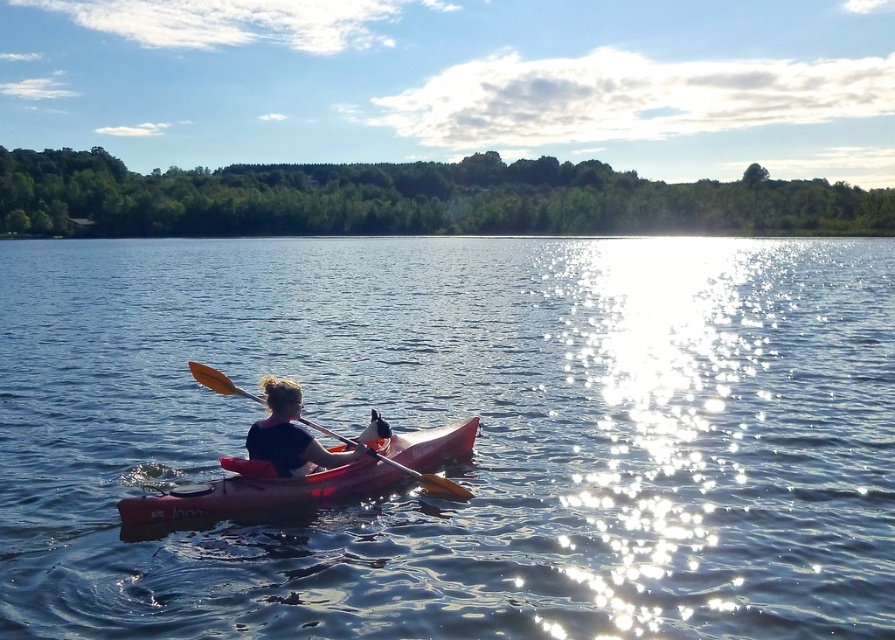
Question: Observing the image, what is the correct spatial positioning of matte red canoe at center in reference to orange wood paddle at center?

Choices:
 (A) above
 (B) below

Answer: (A)

Question: Is glistening blue water at center smaller than orange wood paddle at center?

Choices:
 (A) no
 (B) yes

Answer: (A)

Question: Which object appears farthest from the camera in this image?

Choices:
 (A) matte pink kayak at center
 (B) matte red canoe at center
 (C) glistening blue water at center
 (D) orange wood paddle at center

Answer: (D)

Question: Which of the following is the closest to the observer?

Choices:
 (A) (249, 394)
 (B) (413, 449)
 (C) (486, 388)

Answer: (A)

Question: Among these objects, which one is nearest to the camera?

Choices:
 (A) matte pink kayak at center
 (B) orange wood paddle at center
 (C) glistening blue water at center
 (D) matte red canoe at center

Answer: (C)

Question: Is matte red canoe at center positioned behind matte pink kayak at center?

Choices:
 (A) yes
 (B) no

Answer: (B)